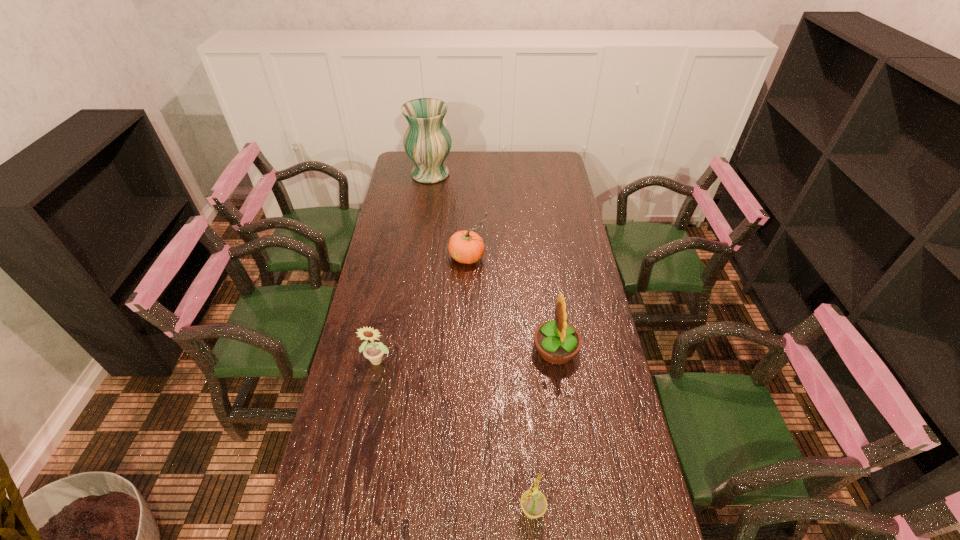
The width and height of the screenshot is (960, 540). Find the location of `the farthest object`. the farthest object is located at coordinates (427, 142).

The width and height of the screenshot is (960, 540). Find the location of `vase`. vase is located at coordinates (427, 142).

Locate an element on the screen. This screenshot has width=960, height=540. the rightmost sunflower is located at coordinates (557, 342).

What are the coordinates of `the rightmost object` in the screenshot? It's located at (557, 342).

Where is `pumpkin`? pumpkin is located at coordinates (467, 247).

Locate an element on the screen. the second farthest object is located at coordinates (467, 247).

The height and width of the screenshot is (540, 960). Find the location of `the leftmost sunflower`. the leftmost sunflower is located at coordinates (374, 351).

Locate an element on the screen. the fourth object from left to right is located at coordinates (533, 503).

The image size is (960, 540). Find the location of `the nearest object`. the nearest object is located at coordinates (533, 503).

Find the location of a particular element. free spot located 0.060m on the right of the vase is located at coordinates (466, 174).